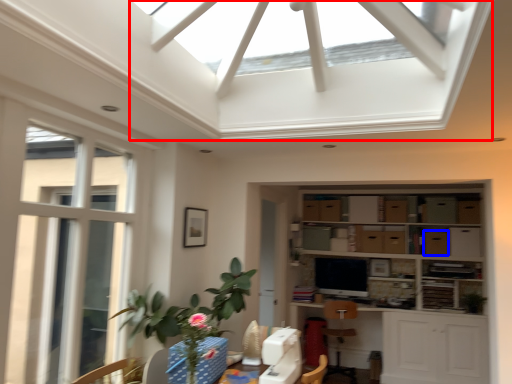
Question: Among these objects, which one is farthest to the camera, exhaust hood (highlighted by a red box) or cabinetry (highlighted by a blue box)?

Choices:
 (A) exhaust hood
 (B) cabinetry

Answer: (B)